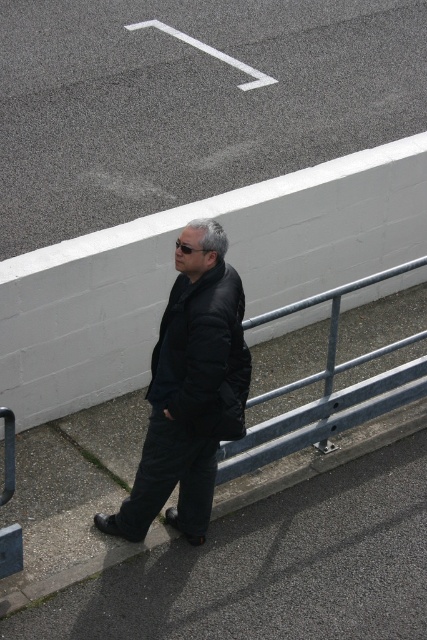
The image size is (427, 640). In order to click on gray asphalt at lower center in this screenshot , I will do `click(272, 566)`.

Who is positioned more to the left, gray asphalt at lower center or black matte jacket at center?

Positioned to the left is black matte jacket at center.

Describe the element at coordinates (272, 566) in the screenshot. I see `gray asphalt at lower center` at that location.

Locate an element on the screen. This screenshot has width=427, height=640. gray asphalt at lower center is located at coordinates (272, 566).

Is black matte jacket at center thinner than black puffy jacket at center?

In fact, black matte jacket at center might be wider than black puffy jacket at center.

Who is lower down, black matte jacket at center or black puffy jacket at center?

black matte jacket at center

Describe the element at coordinates (190, 390) in the screenshot. I see `black matte jacket at center` at that location.

This screenshot has height=640, width=427. Find the location of `black matte jacket at center`. black matte jacket at center is located at coordinates (190, 390).

Who is positioned more to the right, gray asphalt at lower center or black puffy jacket at center?

From the viewer's perspective, gray asphalt at lower center appears more on the right side.

Is gray asphalt at lower center wider than black puffy jacket at center?

Yes, gray asphalt at lower center is wider than black puffy jacket at center.

Is point (216, 614) closer to viewer compared to point (225, 381)?

No, (216, 614) is behind (225, 381).

Where is `gray asphalt at lower center`? gray asphalt at lower center is located at coordinates [272, 566].